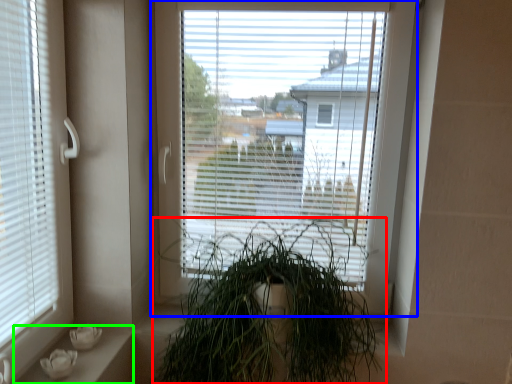
Question: Which object is the farthest from houseplant (highlighted by a red box)? Choose among these: window (highlighted by a blue box) or window sill (highlighted by a green box).

Choices:
 (A) window
 (B) window sill

Answer: (B)